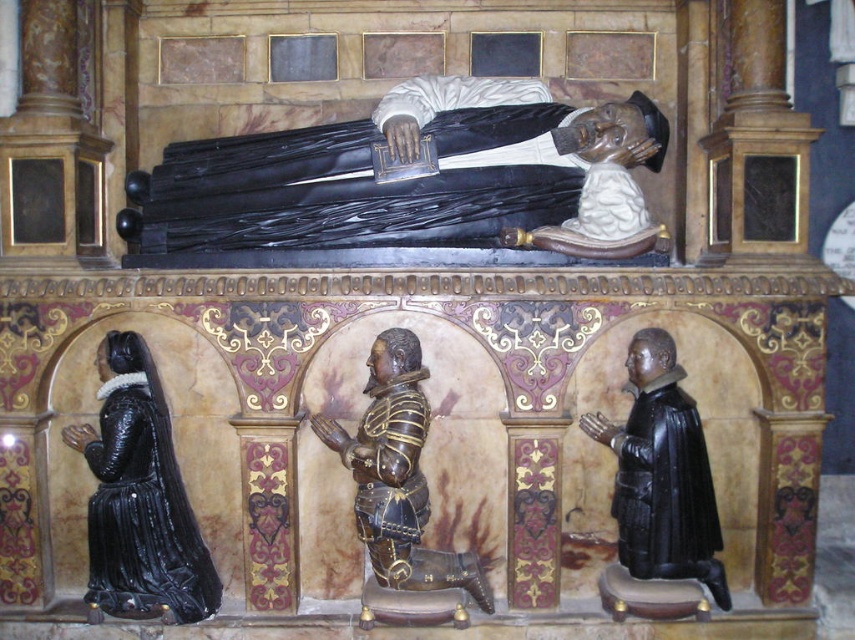
You are an art conservator examining the memorial. You need to clean the black glossy statue at lower left and the black polished wood statue at center. Which statue should you start with to avoid having to climb a ladder?

The black glossy statue at lower left is closer to you than the black polished wood statue at center, so you should start with the black glossy statue at lower left to avoid needing a ladder.

You are an art conservator examining the memorial. You need to determine which statue is wider between the black glossy statue at lower left and the black polished wood statue at center. Which one is wider?

The black glossy statue at lower left is wider than the black polished wood statue at center as stated in the description.